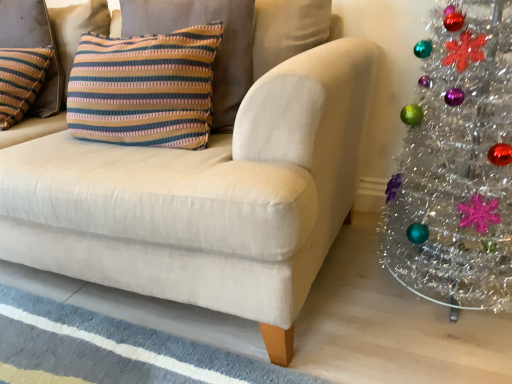
You are a GUI agent. You are given a task and a screenshot of the screen. Output one action in this format:
    pyautogui.click(x=<x>, y=<y>)
    Task: Click on the vacant region to the left of shiny silver christmas tree at right
    This screenshot has width=512, height=384.
    Given the screenshot: What is the action you would take?
    pyautogui.click(x=334, y=304)